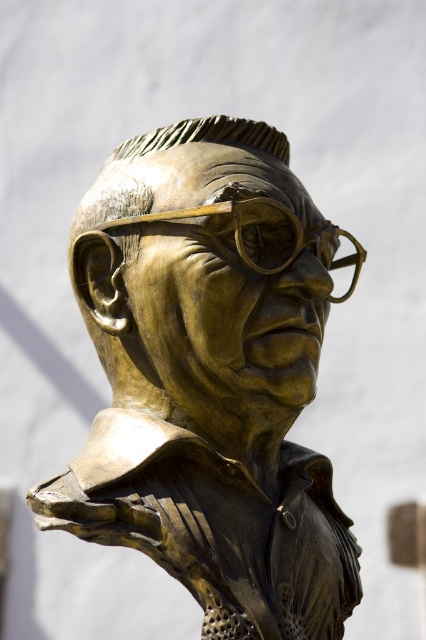
Question: Does bronze statue at center come behind gold textured goggles at center?

Choices:
 (A) no
 (B) yes

Answer: (A)

Question: Does bronze statue at center appear on the right side of gold textured goggles at center?

Choices:
 (A) yes
 (B) no

Answer: (B)

Question: Which of the following is the closest to the observer?

Choices:
 (A) bronze statue at center
 (B) gold textured goggles at center

Answer: (A)

Question: Does bronze statue at center appear under gold textured goggles at center?

Choices:
 (A) yes
 (B) no

Answer: (B)

Question: Among these objects, which one is farthest from the camera?

Choices:
 (A) gold textured goggles at center
 (B) bronze statue at center

Answer: (A)

Question: Which of the following is the farthest from the observer?

Choices:
 (A) (210, 214)
 (B) (282, 154)

Answer: (B)